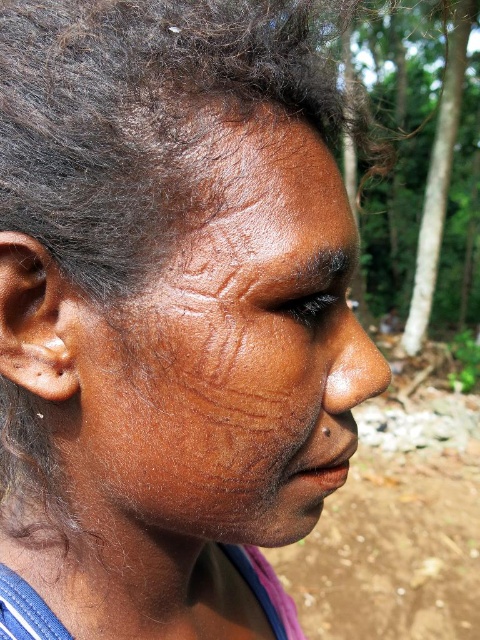
Question: Does brown matte skin at center have a smaller size compared to green leafy tree at upper right?

Choices:
 (A) yes
 (B) no

Answer: (A)

Question: Which of these objects is positioned closest to the dry skin at upper center?

Choices:
 (A) green leafy tree at upper right
 (B) brown matte skin at center

Answer: (B)

Question: Which object is closer to the camera taking this photo?

Choices:
 (A) brown matte skin at center
 (B) dry skin at upper center
 (C) green leafy tree at upper right

Answer: (A)

Question: Which object is the closest to the brown matte skin at center?

Choices:
 (A) dry skin at upper center
 (B) green leafy tree at upper right

Answer: (A)

Question: Does dry skin at upper center lie in front of green leafy tree at upper right?

Choices:
 (A) yes
 (B) no

Answer: (A)

Question: Is brown matte skin at center positioned at the back of green leafy tree at upper right?

Choices:
 (A) no
 (B) yes

Answer: (A)